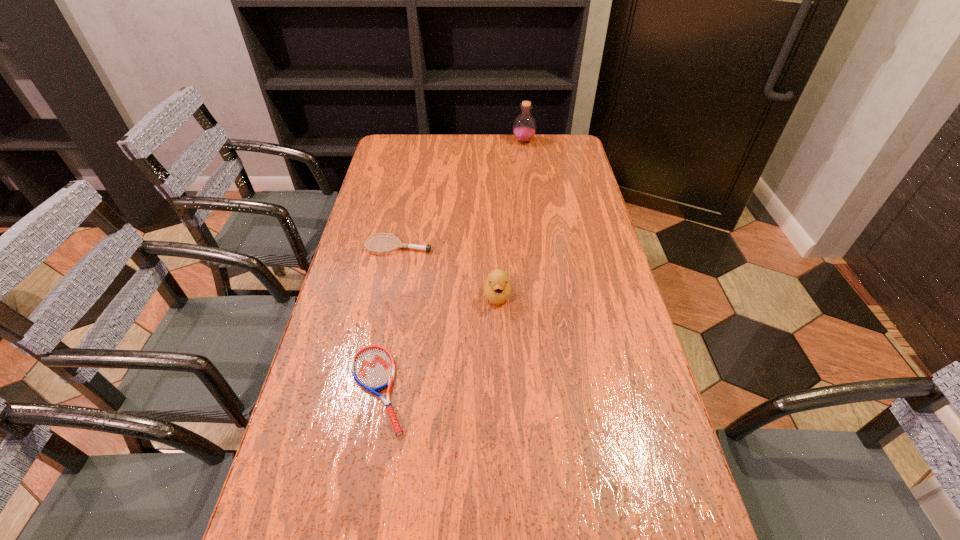
Where is `free space located on the front of the third nearest object`? This screenshot has width=960, height=540. free space located on the front of the third nearest object is located at coordinates (385, 314).

You are a GUI agent. You are given a task and a screenshot of the screen. Output one action in this format:
    pyautogui.click(x=<x>, y=<y>)
    Task: Click on the vacant space located 0.180m on the back of the nearer tennis racket
    This screenshot has width=960, height=540.
    Given the screenshot: What is the action you would take?
    pyautogui.click(x=396, y=294)

The height and width of the screenshot is (540, 960). Identify the location of object at the far edge. (524, 127).

Locate an element on the screen. vacant region at the far edge of the desktop is located at coordinates (434, 136).

Where is `blank space at the left edge of the desktop`? This screenshot has width=960, height=540. blank space at the left edge of the desktop is located at coordinates (394, 221).

This screenshot has width=960, height=540. In the image, there is a desktop. In order to click on free space at the right edge in this screenshot , I will do `click(674, 478)`.

At what (x,y) coordinates should I click in order to perform the action: click on vacant space that is in between the third object from left to right and the third tallest object. Please return your answer as a coordinate pair (x, y). This screenshot has width=960, height=540. Looking at the image, I should click on (448, 271).

The height and width of the screenshot is (540, 960). Identify the location of vacant space in between the farthest object and the second object from right to left. 511,218.

This screenshot has width=960, height=540. I want to click on vacant point located between the shortest object and the farthest object, so click(x=451, y=265).

Locate an element on the screen. unoccupied area between the third farthest object and the tallest object is located at coordinates (511, 218).